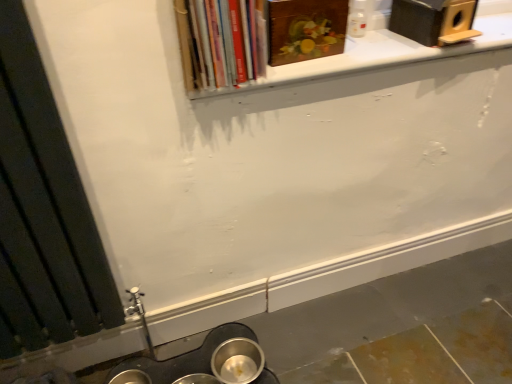
Question: Is black matte radiator at left wider or thinner than wooden painting at upper center, which is the 1th book from right to left?

Choices:
 (A) thin
 (B) wide

Answer: (A)

Question: From the image's perspective, is black matte radiator at left located above or below wooden painting at upper center, which is the 1th book from right to left?

Choices:
 (A) below
 (B) above

Answer: (A)

Question: Based on their relative distances, which object is nearer to the wooden painting at upper center, which is the 1th book from right to left?

Choices:
 (A) hardcover books at upper center, which appears as the second book when viewed from the right
 (B) black matte radiator at left
 (C) white matte window sill at upper center

Answer: (C)

Question: Which object is the farthest from the white matte window sill at upper center?

Choices:
 (A) black matte radiator at left
 (B) wooden painting at upper center, the 2th book viewed from the left
 (C) hardcover books at upper center, which is counted as the 1th book, starting from the left

Answer: (A)